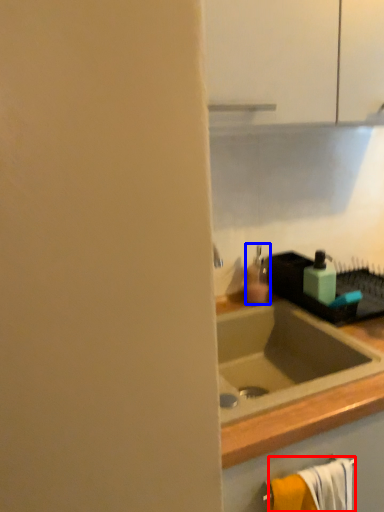
Question: Which object is closer to the camera taking this photo, bath towel (highlighted by a red box) or soap dispenser (highlighted by a blue box)?

Choices:
 (A) bath towel
 (B) soap dispenser

Answer: (A)